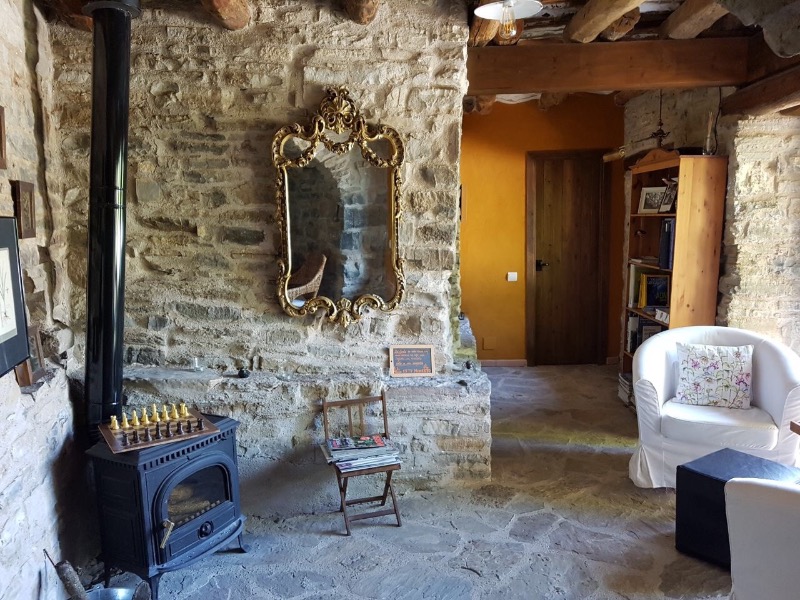
Find the location of `stone floor`. stone floor is located at coordinates (226, 573), (301, 530), (466, 580), (494, 506), (652, 581), (620, 508), (525, 419), (606, 428), (586, 384), (506, 380).